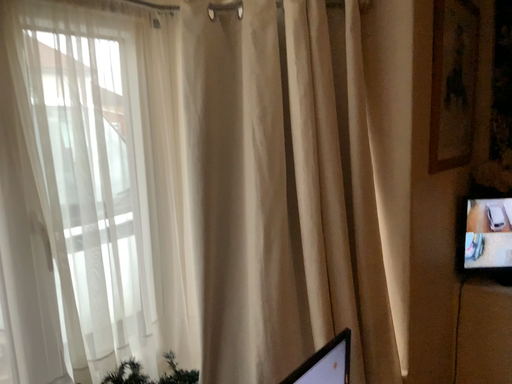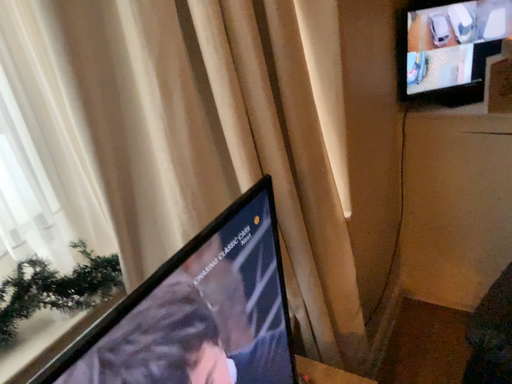
Question: Which way did the camera rotate in the video?

Choices:
 (A) rotated downward
 (B) rotated upward

Answer: (A)